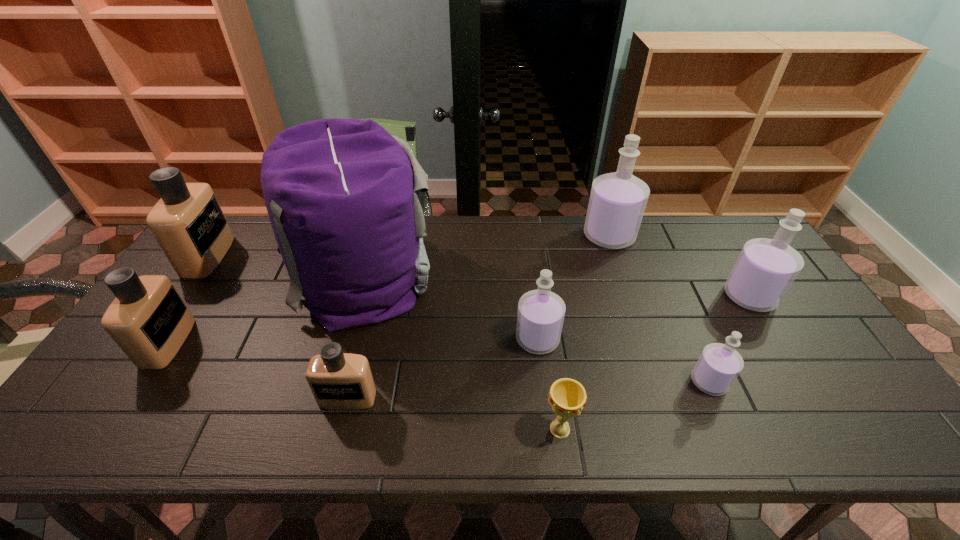
The image size is (960, 540). What are the coordinates of `object that stands as the eighth closest to the third farthest purple perfume` in the screenshot? It's located at (188, 223).

Where is `object that ranks as the seventh closest to the biggest purple perfume`? The image size is (960, 540). object that ranks as the seventh closest to the biggest purple perfume is located at coordinates (148, 319).

The width and height of the screenshot is (960, 540). I want to click on perfume that is the fifth closest to the nearest purple perfume, so click(148, 319).

Identify which perfume is the sixth nearest to the leftmost purple perfume. Please provide its 2D coordinates. Your answer should be formatted as a tuple, i.e. [(x, y)], where the tuple contains the x and y coordinates of a point satisfying the conditions above.

[(188, 223)]

Identify the location of the closest purple perfume relative to the second farthest purple perfume. (718, 366).

Locate which purple perfume is the second closest to the farthest beige perfume. Please provide its 2D coordinates. Your answer should be formatted as a tuple, i.e. [(x, y)], where the tuple contains the x and y coordinates of a point satisfying the conditions above.

[(617, 202)]

Select which beige perfume appears as the closest to the rightmost purple perfume. Please provide its 2D coordinates. Your answer should be formatted as a tuple, i.e. [(x, y)], where the tuple contains the x and y coordinates of a point satisfying the conditions above.

[(339, 381)]

You are a GUI agent. You are given a task and a screenshot of the screen. Output one action in this format:
    pyautogui.click(x=<x>, y=<y>)
    Task: Click on the beige perfume that stands as the closest to the second farthest beige perfume
    The image size is (960, 540).
    Given the screenshot: What is the action you would take?
    pyautogui.click(x=188, y=223)

Locate an element on the screen. This screenshot has width=960, height=540. vacant region that satisfies the following two spatial constraints: 1. on the front pocket of the backpack; 2. on the right side of the third smallest purple perfume is located at coordinates (354, 297).

Locate an element on the screen. Image resolution: width=960 pixels, height=540 pixels. free space that satisfies the following two spatial constraints: 1. on the front label of the third perfume from left to right; 2. on the right side of the chalice is located at coordinates (340, 429).